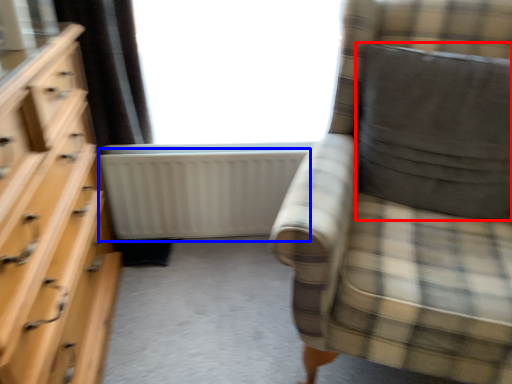
Question: Among these objects, which one is nearest to the camera, pillow (highlighted by a red box) or radiator (highlighted by a blue box)?

Choices:
 (A) pillow
 (B) radiator

Answer: (A)